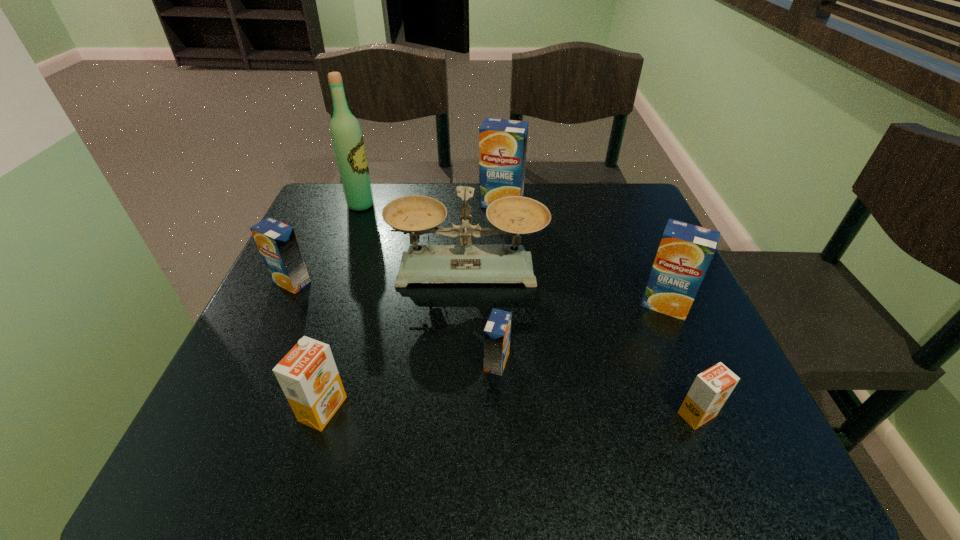
I want to click on the bigger orange orange juice, so click(308, 376).

Locate an element on the screen. Image resolution: width=960 pixels, height=540 pixels. the smallest blue orange_juice is located at coordinates (497, 332).

In order to click on the third nearest object in this screenshot , I will do `click(497, 332)`.

Locate an element on the screen. This screenshot has height=540, width=960. the smaller orange orange juice is located at coordinates (711, 388).

Identify the location of free spot located on the front-facing side of the tallest object. (472, 205).

Locate an element on the screen. free region located 0.120m on the front of the farthest orange juice is located at coordinates (504, 240).

The height and width of the screenshot is (540, 960). I want to click on vacant area situated on the front-facing side of the scale, so click(466, 356).

Locate an element on the screen. The image size is (960, 540). vacant space located on the left of the second tallest orange juice is located at coordinates (512, 304).

Locate an element on the screen. The image size is (960, 540). free space located on the front of the second smallest blue orange_juice is located at coordinates (257, 355).

This screenshot has width=960, height=540. I want to click on free spot located 0.260m on the right of the bigger orange orange juice, so click(x=503, y=409).